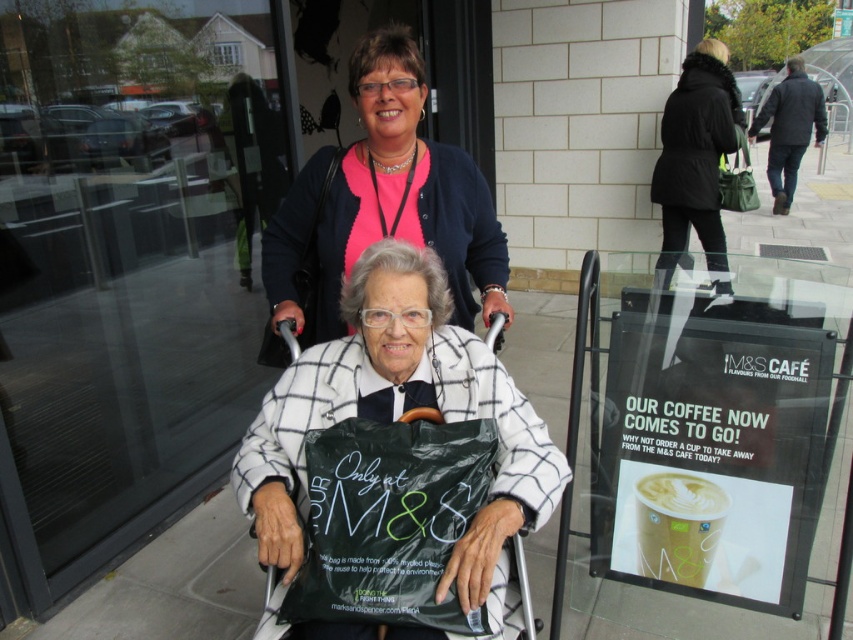
Question: Where is pink fabric shirt at upper center located in relation to black fur coat at upper right in the image?

Choices:
 (A) left
 (B) right

Answer: (A)

Question: Which object is farther from the camera taking this photo?

Choices:
 (A) white checkered coat at center
 (B) pink fabric shirt at upper center
 (C) black matte bag at center
 (D) dark blue jacket at upper right

Answer: (D)

Question: Can you confirm if pink fabric shirt at upper center is bigger than dark blue jacket at upper right?

Choices:
 (A) no
 (B) yes

Answer: (A)

Question: Which point is farther to the camera?

Choices:
 (A) dark blue jacket at upper right
 (B) white checkered coat at center
 (C) black fur coat at upper right

Answer: (A)

Question: Which point appears closest to the camera in this image?

Choices:
 (A) (664, 193)
 (B) (329, 636)
 (C) (804, 112)

Answer: (B)

Question: Is black matte bag at center further to camera compared to dark blue jacket at upper right?

Choices:
 (A) yes
 (B) no

Answer: (B)